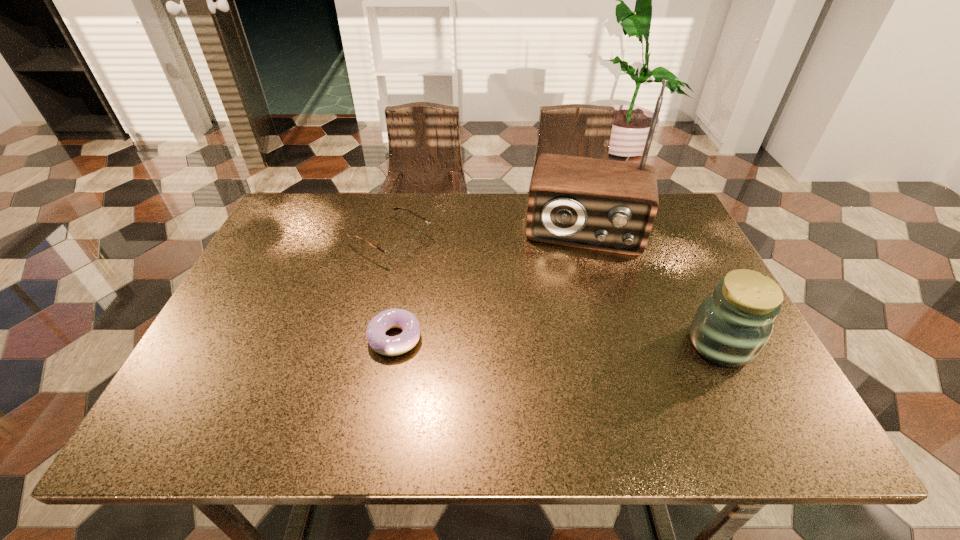
At what (x,y) coordinates should I click in order to perform the action: click on vacant space at the near edge. Please return your answer as a coordinate pair (x, y). This screenshot has height=540, width=960. Looking at the image, I should click on (276, 373).

Where is `free space at the left edge of the desktop`? The width and height of the screenshot is (960, 540). free space at the left edge of the desktop is located at coordinates (304, 279).

Identify the location of vacant space at the right edge of the desktop. (692, 288).

You are a GUI agent. You are given a task and a screenshot of the screen. Output one action in this format:
    pyautogui.click(x=<x>, y=<y>)
    Task: Click on the free space at the near left corner of the desktop
    This screenshot has width=960, height=540.
    Given the screenshot: What is the action you would take?
    pyautogui.click(x=250, y=362)

Identify the location of blank region between the second tallest object and the second shortest object. The width and height of the screenshot is (960, 540). (556, 292).

Find the location of a particular element. The height and width of the screenshot is (540, 960). vacant area that lies between the doughnut and the radio receiver is located at coordinates (490, 284).

At what (x,y) coordinates should I click in order to perform the action: click on empty space that is in between the doughnut and the jar. Please return your answer as a coordinate pair (x, y). The width and height of the screenshot is (960, 540). Looking at the image, I should click on (557, 341).

The height and width of the screenshot is (540, 960). Identify the location of vacant space in between the tallest object and the jar. (653, 287).

Find the location of `unoccupied area between the spectacles and the doughnut`. unoccupied area between the spectacles and the doughnut is located at coordinates click(393, 289).

Locate an element on the screen. This screenshot has height=540, width=960. vacant space that's between the doughnut and the jar is located at coordinates (557, 341).